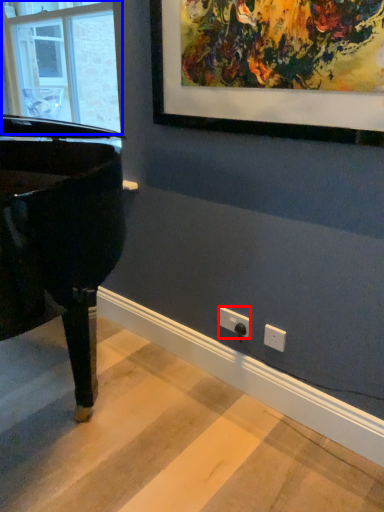
Question: Which object is closer to the camera taking this photo, electric outlet (highlighted by a red box) or window (highlighted by a blue box)?

Choices:
 (A) electric outlet
 (B) window

Answer: (A)